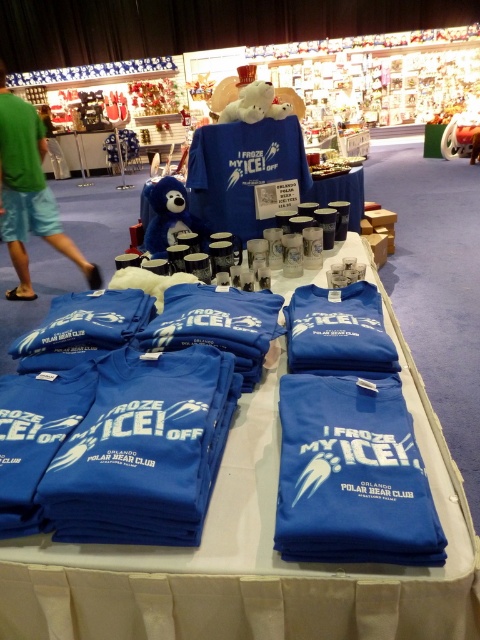
Question: From the image, what is the correct spatial relationship of green fabric shorts at lower left in relation to green cotton t-shirt at left?

Choices:
 (A) above
 (B) below

Answer: (B)

Question: Estimate the real-world distances between objects in this image. Which object is closer to the green cotton t-shirt at left?

Choices:
 (A) blue fabric t-shirts at center
 (B) blue matte t-shirt at center
 (C) green fabric shorts at lower left

Answer: (C)

Question: Among these points, which one is nearest to the camera?

Choices:
 (A) (25, 172)
 (B) (405, 618)

Answer: (B)

Question: Which object appears closest to the camera in this image?

Choices:
 (A) blue fabric t-shirts at center
 (B) green fabric shorts at lower left
 (C) green cotton t-shirt at left
 (D) blue matte t-shirt at center

Answer: (D)

Question: Where is blue matte t-shirt at center located in relation to green cotton t-shirt at left in the image?

Choices:
 (A) left
 (B) right

Answer: (B)

Question: Is blue fabric t-shirts at center wider than green cotton t-shirt at left?

Choices:
 (A) no
 (B) yes

Answer: (B)